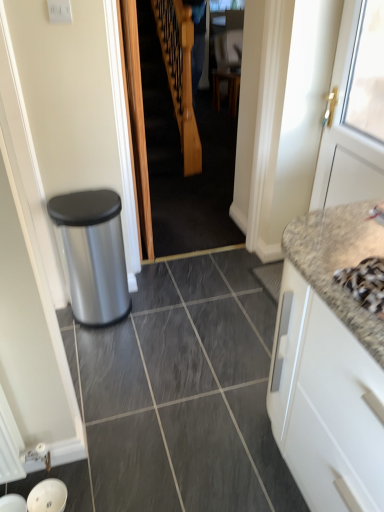
The width and height of the screenshot is (384, 512). I want to click on vacant area in front of wooden staircase at center, so click(197, 311).